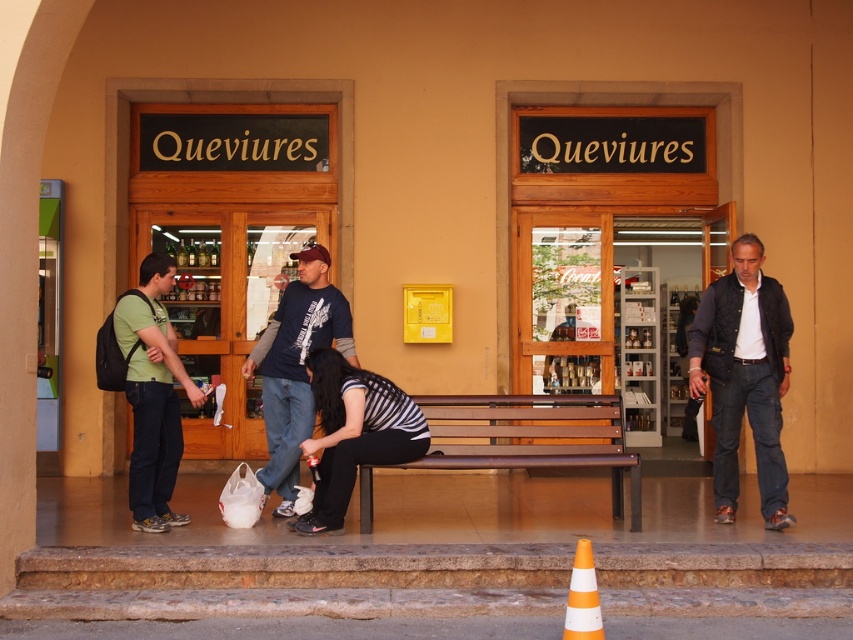
You are a delivery person holding a package that requires placing on the brown wooden bench at center without getting too close to the dark blue quilted vest at right. The minimum safe distance you need to maintain is 3 feet. Can you place the package on the bench?

The distance between the dark blue quilted vest at right and the brown wooden bench at center is 3.61 feet. Since 3.61 feet is greater than the required 3 feet minimum safe distance, you can place the package on the bench while maintaining the safe distance.